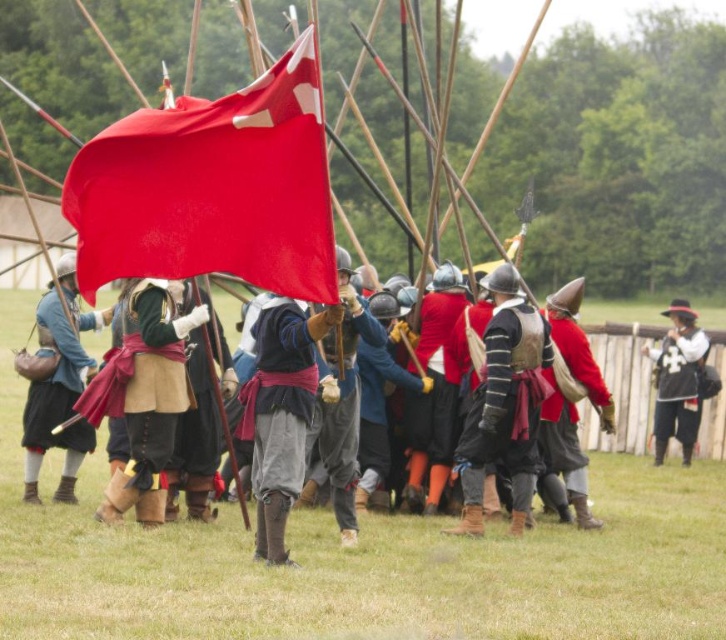
Question: Among these objects, which one is farthest from the camera?

Choices:
 (A) smooth black vest at right
 (B) red velvet hat at center
 (C) matte red flag at center

Answer: (A)

Question: Does matte red flag at center have a lesser width compared to smooth black vest at right?

Choices:
 (A) no
 (B) yes

Answer: (A)

Question: Can you confirm if smooth red flag at center is positioned to the left of matte leather bag at center?

Choices:
 (A) yes
 (B) no

Answer: (B)

Question: Which object is the farthest from the smooth red flag at center?

Choices:
 (A) matte red flag at center
 (B) smooth black vest at right
 (C) matte leather bag at center
 (D) red velvet hat at center

Answer: (B)

Question: Considering the relative positions of matte leather bag at center and smooth black vest at right in the image provided, where is matte leather bag at center located with respect to smooth black vest at right?

Choices:
 (A) below
 (B) above

Answer: (B)

Question: Estimate the real-world distances between objects in this image. Which object is farther from the smooth black vest at right?

Choices:
 (A) smooth red flag at center
 (B) matte red flag at center
 (C) matte leather bag at center
 (D) red velvet hat at center

Answer: (A)